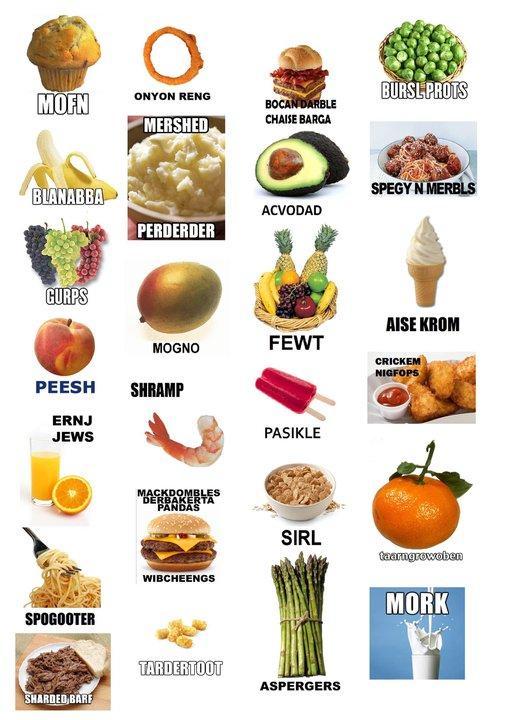
Locate an element on the screen. column 3 is located at coordinates (302, 26).